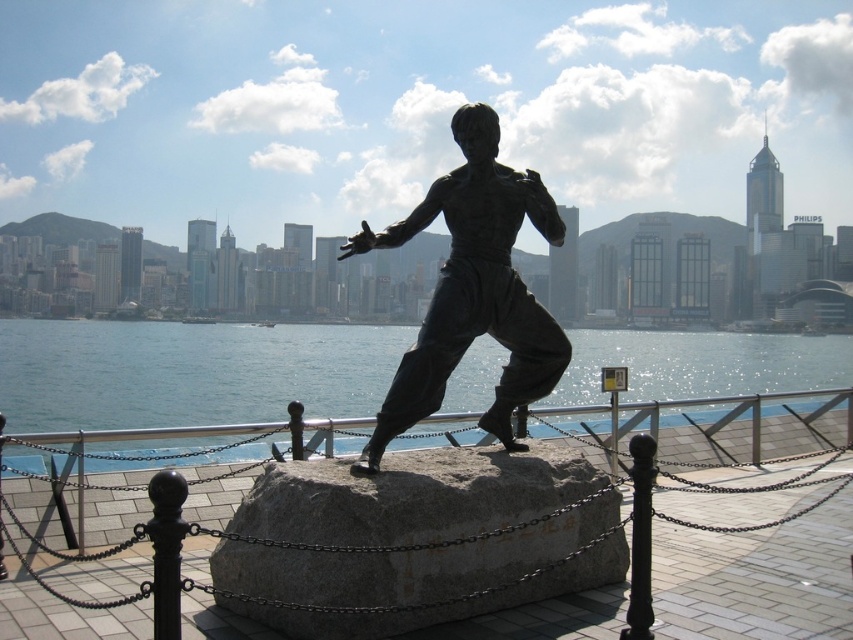
Question: Which point is closer to the camera taking this photo?

Choices:
 (A) (439, 371)
 (B) (403, 598)

Answer: (B)

Question: Can you confirm if clear blue water at center is positioned above bronze statue at center?

Choices:
 (A) yes
 (B) no

Answer: (B)

Question: Is gray granite stone at center below bronze statue at center?

Choices:
 (A) yes
 (B) no

Answer: (A)

Question: Which point is closer to the camera taking this photo?

Choices:
 (A) (294, 628)
 (B) (42, 422)

Answer: (A)

Question: Which point is closer to the camera?

Choices:
 (A) (19, 426)
 (B) (512, 232)

Answer: (B)

Question: Does gray granite stone at center have a smaller size compared to bronze statue at center?

Choices:
 (A) yes
 (B) no

Answer: (A)